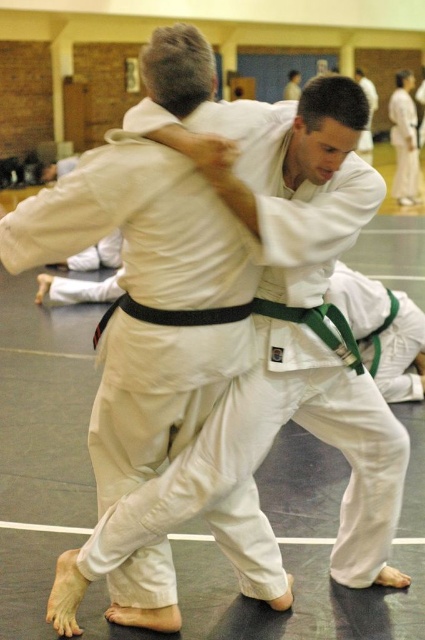
Question: Does green belt at lower right have a larger size compared to white karate gi at center?

Choices:
 (A) no
 (B) yes

Answer: (A)

Question: Is green belt at lower right closer to the viewer compared to white karate gi at center?

Choices:
 (A) no
 (B) yes

Answer: (A)

Question: Among these points, which one is nearest to the camera?

Choices:
 (A) (410, 360)
 (B) (362, 77)

Answer: (A)

Question: Which point is farther to the camera?

Choices:
 (A) (359, 147)
 (B) (404, 332)

Answer: (A)

Question: Does green belt at lower right appear on the right side of white karate gi at center?

Choices:
 (A) no
 (B) yes

Answer: (A)